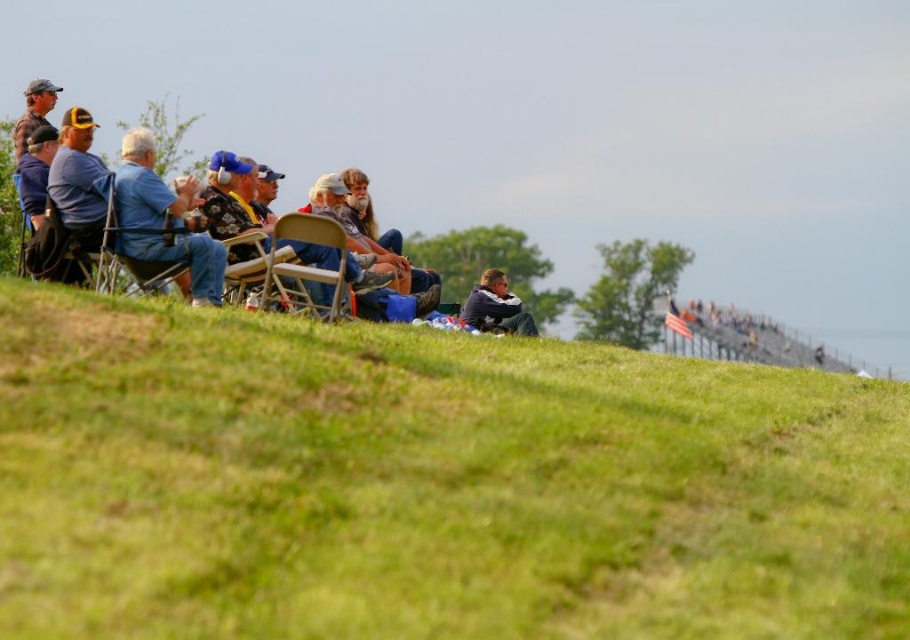
Is green grassy hillside at lower left below metallic silver folding chair at center?

Yes, green grassy hillside at lower left is below metallic silver folding chair at center.

Who is more forward, (408, 529) or (322, 221)?

Point (408, 529) is in front.

Does point (858, 381) come in front of point (332, 269)?

Yes, it is.

Locate an element on the screen. Image resolution: width=910 pixels, height=640 pixels. green grassy hillside at lower left is located at coordinates (430, 483).

What do you see at coordinates (28, 196) in the screenshot? Image resolution: width=910 pixels, height=640 pixels. I see `denim jacket at center` at bounding box center [28, 196].

Which is below, denim jacket at center or brown leather jacket at upper left?

brown leather jacket at upper left

Is point (82, 125) more distant than point (25, 134)?

No, it is in front of (25, 134).

Where is `denim jacket at center`? The image size is (910, 640). denim jacket at center is located at coordinates (28, 196).

Can you confirm if metallic silver folding chair at center is thinner than brown leather jacket at upper left?

Indeed, metallic silver folding chair at center has a lesser width compared to brown leather jacket at upper left.

Between point (320, 234) and point (28, 99), which one is positioned in front?

Positioned in front is point (320, 234).

I want to click on metallic silver folding chair at center, so click(x=309, y=257).